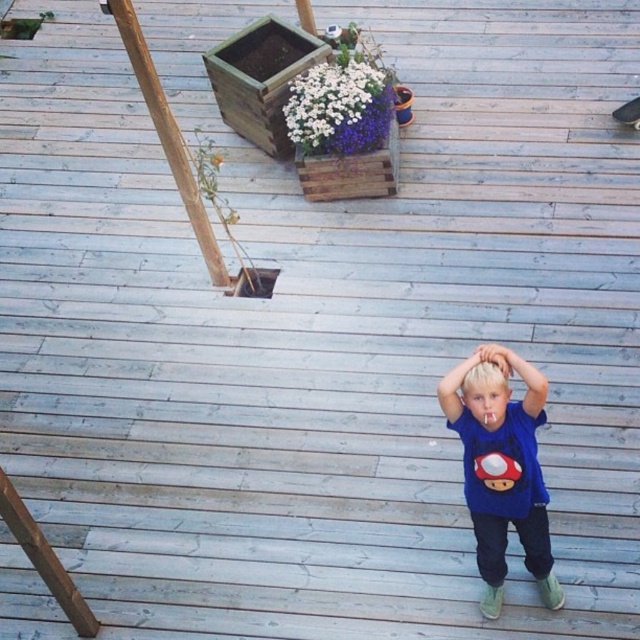
Between point (508, 384) and point (492, 342), which one is positioned in front?

Point (508, 384)

Between point (499, 417) and point (508, 374), which one is positioned in front?

Point (508, 374)

This screenshot has width=640, height=640. In order to click on blonde hair at center in this screenshot , I will do `click(484, 387)`.

Which of these two, blue cotton shirt at center or smooth skin hand at center, stands shorter?

With less height is smooth skin hand at center.

The width and height of the screenshot is (640, 640). Describe the element at coordinates (500, 470) in the screenshot. I see `blue cotton shirt at center` at that location.

Is point (486, 572) closer to camera compared to point (502, 348)?

No, it is behind (502, 348).

This screenshot has width=640, height=640. What are the coordinates of `blue cotton shirt at center` in the screenshot? It's located at (500, 470).

Who is higher up, blue cotton shirt at center or blonde hair at center?

blonde hair at center is higher up.

Does blue cotton shirt at center have a larger size compared to blonde hair at center?

Correct, blue cotton shirt at center is larger in size than blonde hair at center.

Between point (541, 480) and point (467, 356), which one is positioned in front?

Point (541, 480) is more forward.

Find the location of a particular element. The width and height of the screenshot is (640, 640). blue cotton shirt at center is located at coordinates (500, 470).